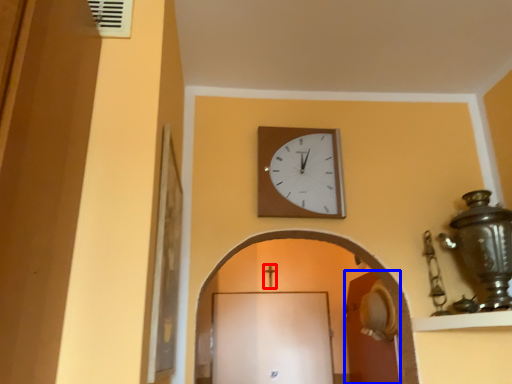
Question: Among these objects, which one is farthest to the camera, crucifix (highlighted by a red box) or door (highlighted by a blue box)?

Choices:
 (A) crucifix
 (B) door

Answer: (A)